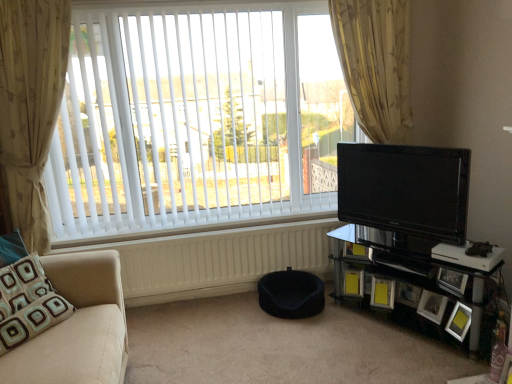
Question: Considering the relative sizes of beige fabric studio couch at left and wooden photo frame at lower right, which is the 2th picture frame in right-to-left order, in the image provided, is beige fabric studio couch at left taller than wooden photo frame at lower right, which is the 2th picture frame in right-to-left order,?

Choices:
 (A) yes
 (B) no

Answer: (A)

Question: Is wooden photo frame at lower right, which appears as the fifth picture frame when viewed from the left, located within beige fabric studio couch at left?

Choices:
 (A) yes
 (B) no

Answer: (B)

Question: Is beige fabric studio couch at left to the right of wooden photo frame at lower right, which appears as the fifth picture frame when viewed from the left, from the viewer's perspective?

Choices:
 (A) yes
 (B) no

Answer: (B)

Question: Is beige fabric studio couch at left oriented away from wooden photo frame at lower right, which appears as the fifth picture frame when viewed from the left?

Choices:
 (A) yes
 (B) no

Answer: (B)

Question: Does beige fabric studio couch at left have a lesser height compared to wooden photo frame at lower right, which appears as the fifth picture frame when viewed from the left?

Choices:
 (A) no
 (B) yes

Answer: (A)

Question: Looking at their shapes, would you say black fabric pet bed at lower center is wider or thinner than teal fabric pillow at lower left?

Choices:
 (A) thin
 (B) wide

Answer: (B)

Question: In the image, is black fabric pet bed at lower center on the left side or the right side of teal fabric pillow at lower left?

Choices:
 (A) left
 (B) right

Answer: (B)

Question: From the image's perspective, is black fabric pet bed at lower center positioned above or below teal fabric pillow at lower left?

Choices:
 (A) above
 (B) below

Answer: (B)

Question: Considering their positions, is black fabric pet bed at lower center located in front of or behind teal fabric pillow at lower left?

Choices:
 (A) front
 (B) behind

Answer: (B)

Question: Does point (355, 51) appear closer or farther from the camera than point (35, 69)?

Choices:
 (A) closer
 (B) farther

Answer: (B)

Question: In terms of size, does gold floral fabric curtain at upper right, positioned as the second curtain in left-to-right order, appear bigger or smaller than beige floral fabric curtain at left, which is the second curtain from right to left?

Choices:
 (A) small
 (B) big

Answer: (B)

Question: Is gold floral fabric curtain at upper right, positioned as the second curtain in left-to-right order, in front of or behind beige floral fabric curtain at left, acting as the 1th curtain starting from the left, in the image?

Choices:
 (A) front
 (B) behind

Answer: (B)

Question: Considering the positions of gold floral fabric curtain at upper right, positioned as the second curtain in left-to-right order, and beige floral fabric curtain at left, which is the second curtain from right to left, in the image, is gold floral fabric curtain at upper right, positioned as the second curtain in left-to-right order, taller or shorter than beige floral fabric curtain at left, which is the second curtain from right to left,?

Choices:
 (A) tall
 (B) short

Answer: (B)

Question: Choose the correct answer: Is white matte radiator at lower center inside matte black picture frame at lower right, which appears as the third picture frame when viewed from the left, or outside it?

Choices:
 (A) outside
 (B) inside

Answer: (A)

Question: Is white matte radiator at lower center to the left or to the right of matte black picture frame at lower right, which appears as the third picture frame when viewed from the left, in the image?

Choices:
 (A) left
 (B) right

Answer: (A)